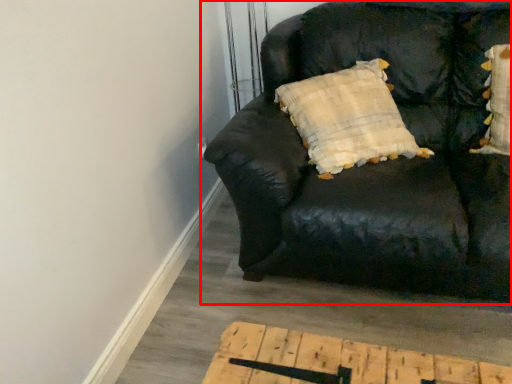
Question: From the image's perspective, where is studio couch (annotated by the red box) located in relation to pillow in the image?

Choices:
 (A) below
 (B) above

Answer: (A)